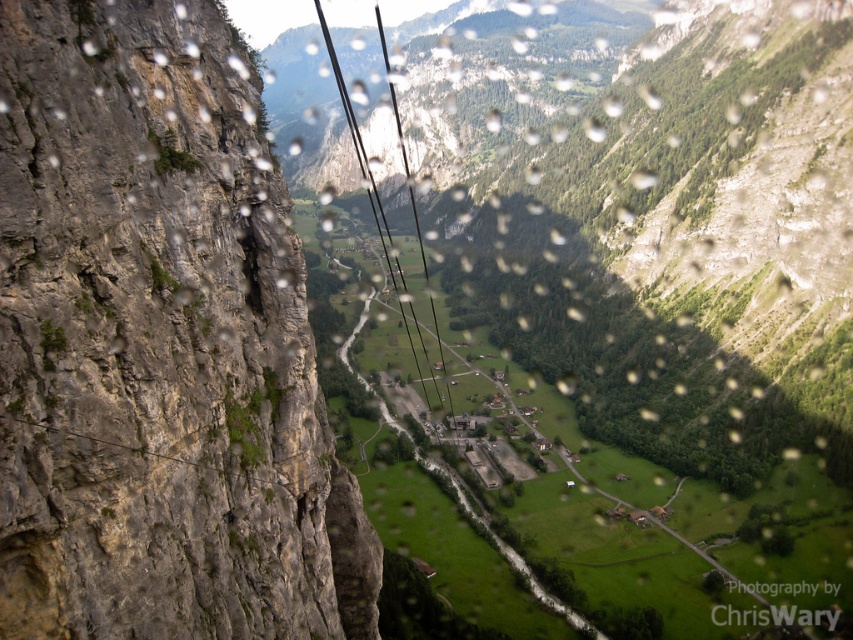
Who is more distant from viewer, (161,547) or (389,273)?

The point (389,273) is behind.

Who is shorter, rocky gray at left or black wire at center?

With less height is rocky gray at left.

I want to click on rocky gray at left, so click(158, 346).